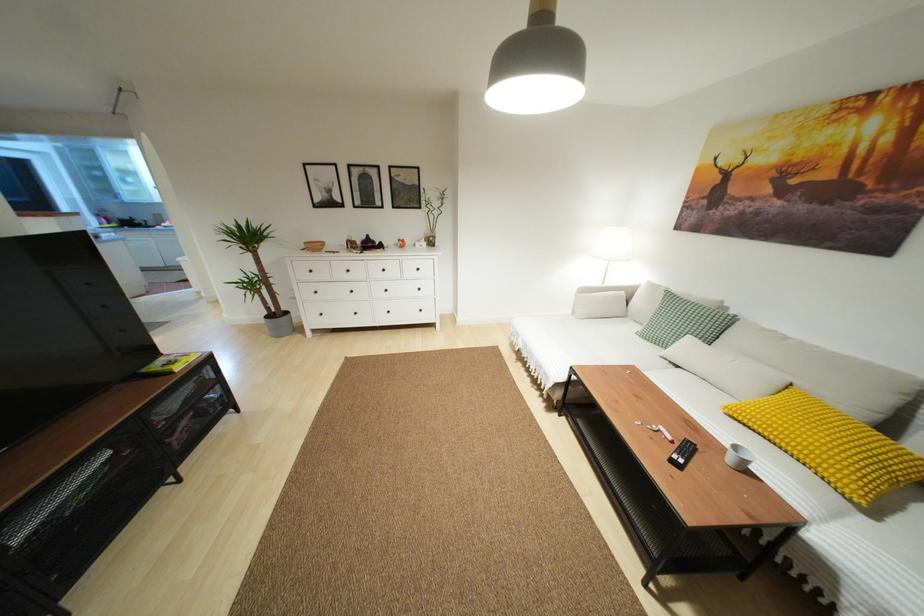
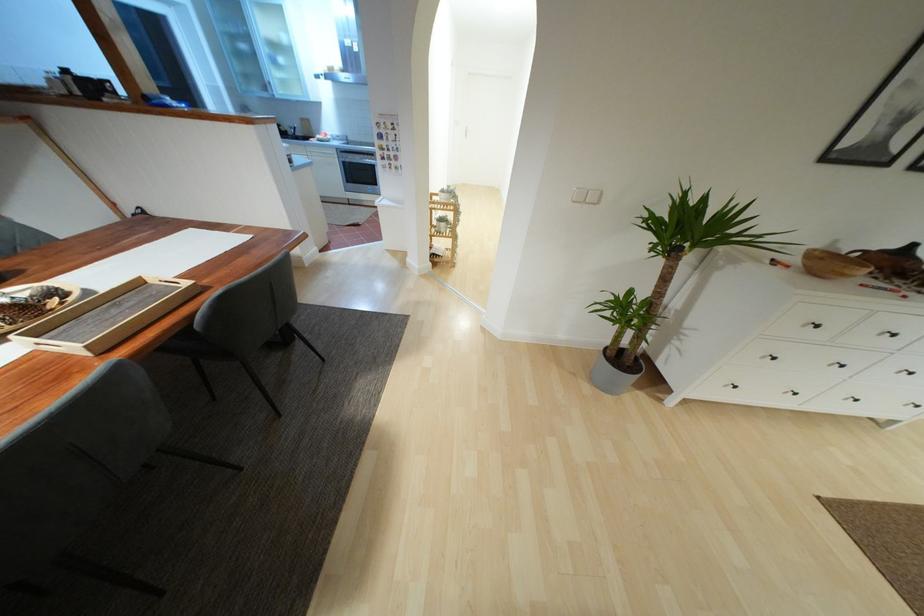
Find the pixel in the second image that matches pixel 355 313 in the first image.

(795, 394)